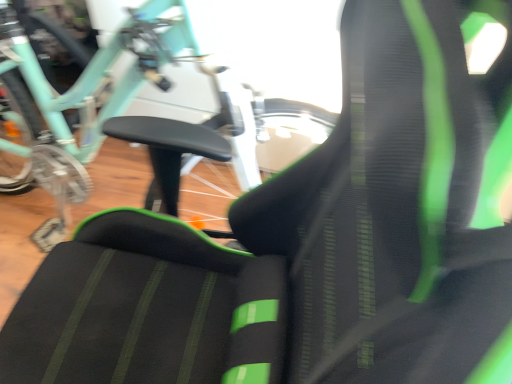
In order to face matte teal bicycle at upper left, should I rotate leftwards or rightwards?

Rotate your view left by about 16.575°.

The image size is (512, 384). Find the location of `matte teal bicycle at upper left`. matte teal bicycle at upper left is located at coordinates (180, 87).

What is the approximate width of matte teal bicycle at upper left?

matte teal bicycle at upper left is 53.70 centimeters wide.

Image resolution: width=512 pixels, height=384 pixels. Describe the element at coordinates (180, 87) in the screenshot. I see `matte teal bicycle at upper left` at that location.

Image resolution: width=512 pixels, height=384 pixels. I want to click on matte teal bicycle at upper left, so click(x=180, y=87).